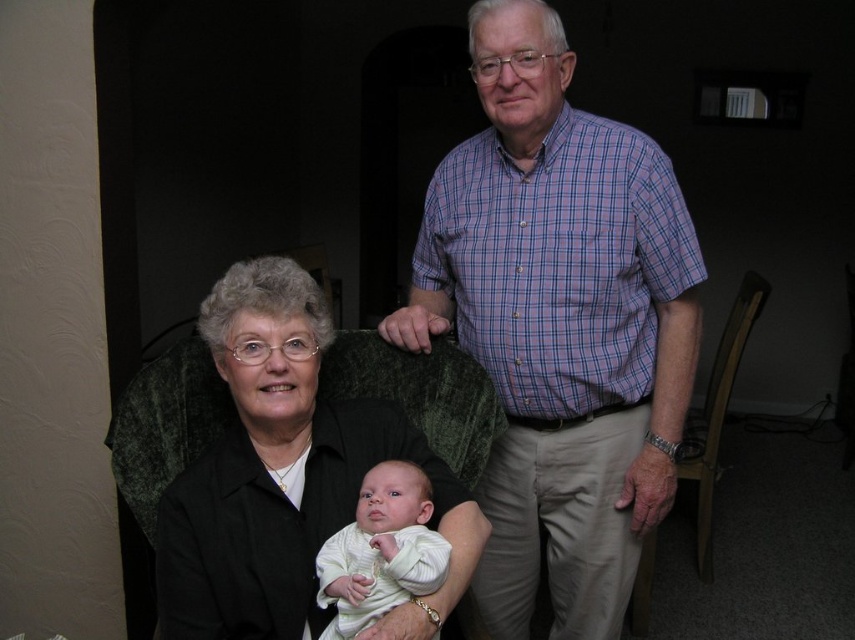
Who is taller, black fabric at center or white soft fabric baby at center?

With more height is black fabric at center.

Is black fabric at center further to the viewer compared to white soft fabric baby at center?

No.

Identify the location of black fabric at center. The image size is (855, 640). (287, 476).

Is point (509, 32) more distant than point (376, 476)?

Yes, point (509, 32) is farther from viewer.

Describe the element at coordinates (559, 323) in the screenshot. I see `plaid cotton shirt at center` at that location.

Locate an element on the screen. The image size is (855, 640). plaid cotton shirt at center is located at coordinates (559, 323).

Where is `plaid cotton shirt at center`? Image resolution: width=855 pixels, height=640 pixels. plaid cotton shirt at center is located at coordinates (559, 323).

Who is more forward, (555, 433) or (243, 470)?

Point (243, 470)

The height and width of the screenshot is (640, 855). Describe the element at coordinates (559, 323) in the screenshot. I see `plaid cotton shirt at center` at that location.

Identify the location of plaid cotton shirt at center. (559, 323).